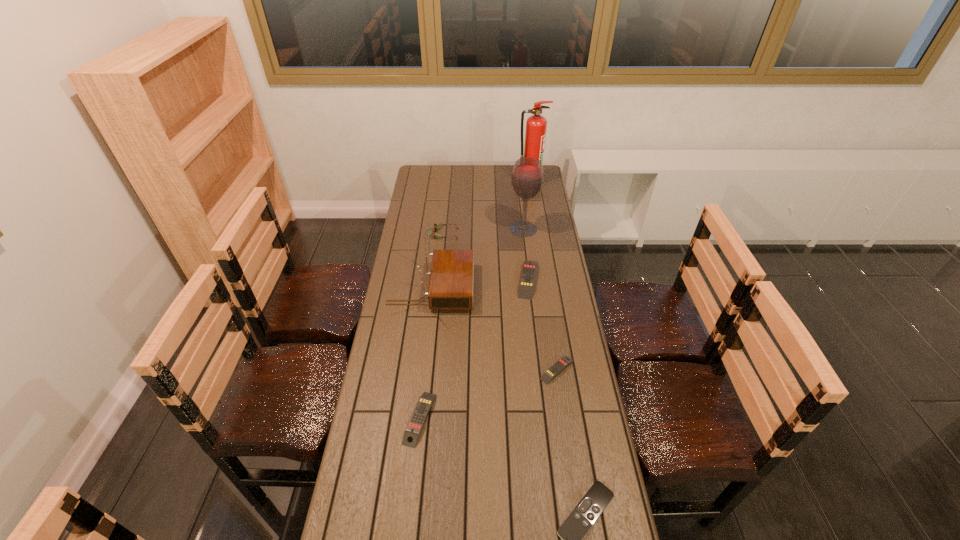
Find the location of a particular element. The height and width of the screenshot is (540, 960). the tallest object is located at coordinates pos(536,125).

I want to click on the farthest object, so click(536, 125).

Find the location of a particular element. The image size is (960, 540). alcohol is located at coordinates tap(527, 178).

Image resolution: width=960 pixels, height=540 pixels. In order to click on the second tallest object in this screenshot , I will do `click(527, 178)`.

Find the location of a particular element. This screenshot has height=540, width=960. radio_receiver is located at coordinates (450, 287).

Where is `spectacles`? The image size is (960, 540). spectacles is located at coordinates (436, 226).

In order to click on the fifth tallest object in this screenshot , I will do `click(529, 268)`.

At what (x,y) coordinates should I click in order to perform the action: click on the tallest remote control. Please return your answer as a coordinate pair (x, y). The height and width of the screenshot is (540, 960). Looking at the image, I should click on (529, 268).

The width and height of the screenshot is (960, 540). I want to click on the seventh farthest object, so click(424, 404).

You are a GUI agent. You are given a task and a screenshot of the screen. Output one action in this format:
    pyautogui.click(x=<x>, y=<y>)
    Task: Click on the nearest yellow remote control
    The image size is (960, 540).
    Given the screenshot: What is the action you would take?
    pyautogui.click(x=424, y=404)